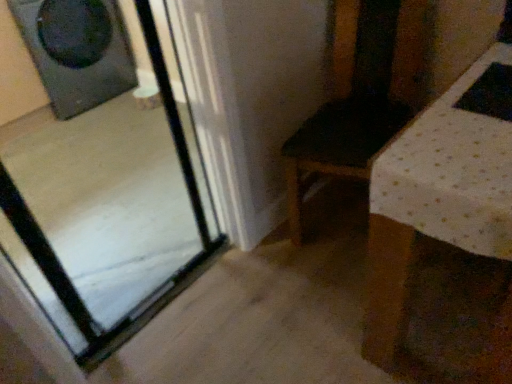
Question: Considering the positions of point (27, 117) and point (40, 39), is point (27, 117) closer or farther from the camera than point (40, 39)?

Choices:
 (A) closer
 (B) farther

Answer: (B)

Question: Is transparent glass door at left to the left or to the right of matte black speaker at upper left in the image?

Choices:
 (A) right
 (B) left

Answer: (A)

Question: From the image's perspective, is transparent glass door at left positioned above or below matte black speaker at upper left?

Choices:
 (A) above
 (B) below

Answer: (B)

Question: From a real-world perspective, is matte black speaker at upper left physically located above or below transparent glass door at left?

Choices:
 (A) below
 (B) above

Answer: (A)

Question: Is matte black speaker at upper left in front of or behind transparent glass door at left in the image?

Choices:
 (A) behind
 (B) front

Answer: (A)

Question: Considering the positions of point (53, 104) and point (54, 246), is point (53, 104) closer or farther from the camera than point (54, 246)?

Choices:
 (A) farther
 (B) closer

Answer: (A)

Question: From the image's perspective, relative to transparent glass door at left, is matte black speaker at upper left above or below?

Choices:
 (A) below
 (B) above

Answer: (B)